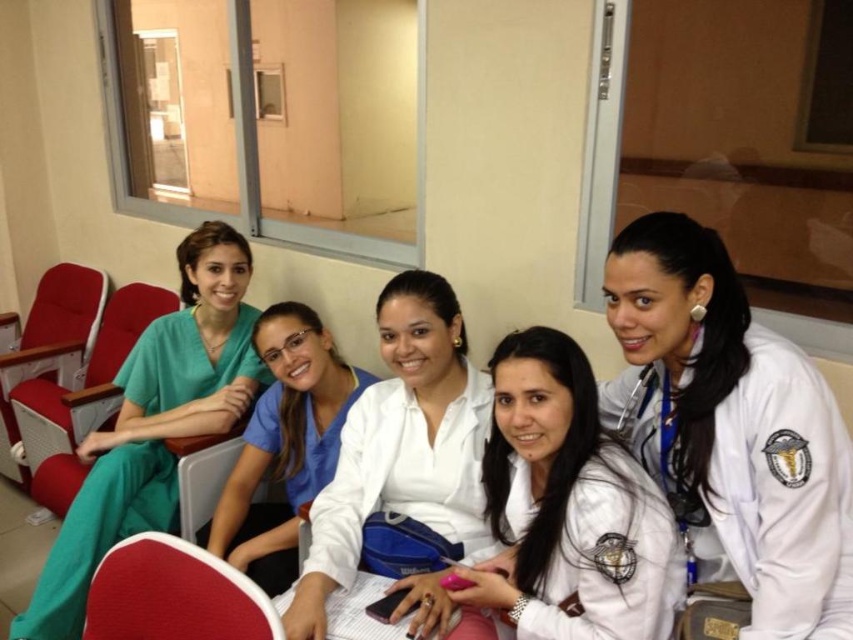
Is green scrubs at left closer to camera compared to red fabric chair at lower left?

That is False.

Can you confirm if green scrubs at left is thinner than red fabric chair at lower left?

No, green scrubs at left is not thinner than red fabric chair at lower left.

Which is behind, point (175, 518) or point (201, 579)?

Positioned behind is point (175, 518).

What are the coordinates of `green scrubs at left` in the screenshot? It's located at (154, 422).

Who is lower down, white matte shirt at center or blue scrubs at center?

Positioned lower is white matte shirt at center.

This screenshot has height=640, width=853. Describe the element at coordinates (567, 506) in the screenshot. I see `white matte shirt at center` at that location.

Where is `white matte shirt at center`? The width and height of the screenshot is (853, 640). white matte shirt at center is located at coordinates (567, 506).

In the scene shown: Is white matte shirt at center shorter than green scrubs at left?

Yes, white matte shirt at center is shorter than green scrubs at left.

Does point (573, 456) come behind point (84, 460)?

No, (573, 456) is closer to viewer.

Find the location of a particular element. This screenshot has height=640, width=853. white matte shirt at center is located at coordinates 567,506.